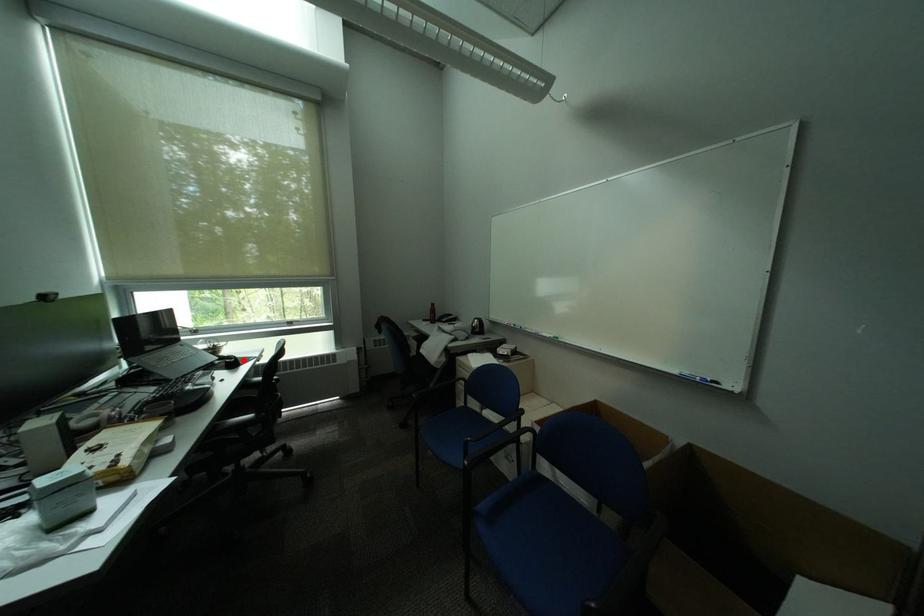
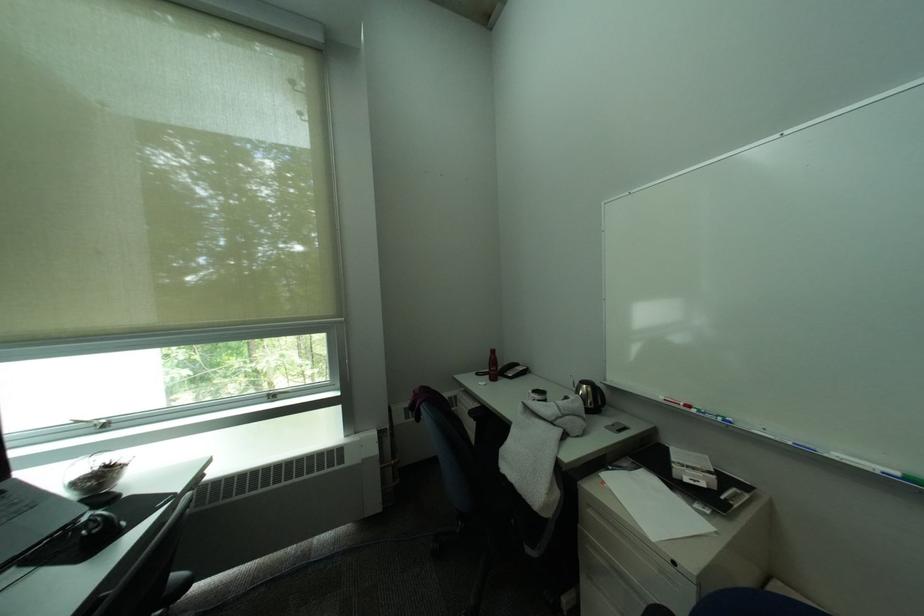
Locate, in the second image, the point that corresponds to the highlighted location in the first image.

(106, 528)